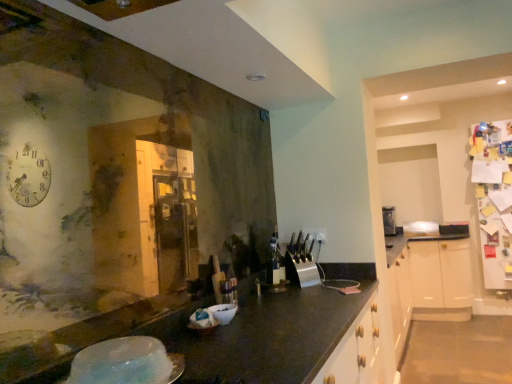
Identify the location of free space above translucent plastic bowl at lower left (from a real-world perspective). The image size is (512, 384). (125, 342).